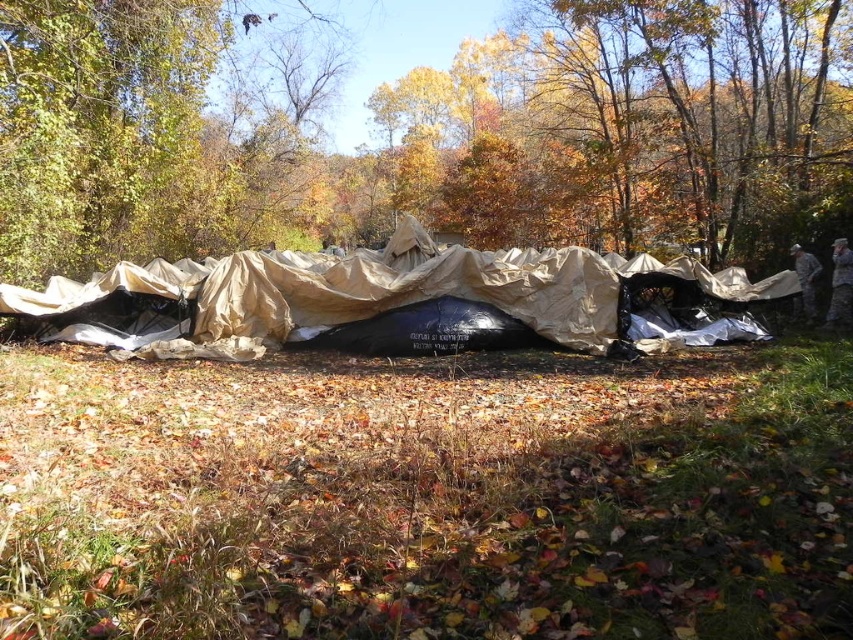
You are a hiker planning to set up your tent. You see the brown matte tarp at center and the tan fabric tent at center in the image. Which object is wider?

The brown matte tarp at center is wider than the tan fabric tent at center.

You are standing at the origin point in the image. There is a point marked at coordinates (456, 141). What object is located at this point?

The point (456, 141) corresponds to the brown matte tarp at center.

You are a hiker who needs to decide between using the brown matte tarp at center or the tan fabric tent at center for shelter. Which one provides more coverage area?

The brown matte tarp at center is bigger than the tan fabric tent at center, so it provides more coverage area.